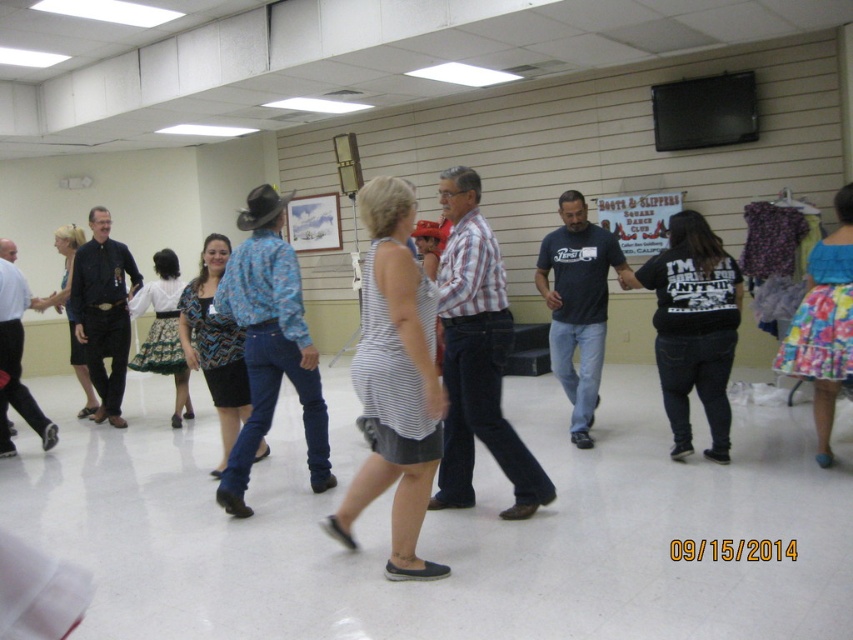
Is point (416, 371) farther from viewer compared to point (155, 310)?

No, it is not.

Is striped fabric dress at center to the right of printed cotton dress at center from the viewer's perspective?

Indeed, striped fabric dress at center is positioned on the right side of printed cotton dress at center.

What do you see at coordinates (393, 381) in the screenshot?
I see `striped fabric dress at center` at bounding box center [393, 381].

You are a GUI agent. You are given a task and a screenshot of the screen. Output one action in this format:
    pyautogui.click(x=<x>, y=<y>)
    Task: Click on the striped fabric dress at center
    This screenshot has width=853, height=640.
    Given the screenshot: What is the action you would take?
    pyautogui.click(x=393, y=381)

Does dark blue t-shirt at center have a greater width compared to blue printed blouse at center?

Incorrect, dark blue t-shirt at center's width does not surpass blue printed blouse at center's.

Which is behind, point (602, 298) or point (254, 460)?

The point (254, 460) is behind.

Where is `dark blue t-shirt at center`? Image resolution: width=853 pixels, height=640 pixels. dark blue t-shirt at center is located at coordinates (578, 305).

Looking at this image, who is more forward, (566, 317) or (827, 364)?

Point (827, 364) is in front.

Looking at this image, is dark blue t-shirt at center positioned at the back of floral fabric skirt at lower right?

That is True.

Is point (575, 196) farther from camera compared to point (836, 234)?

Yes, it is behind point (836, 234).

Find the location of a particular element. dark blue t-shirt at center is located at coordinates (578, 305).